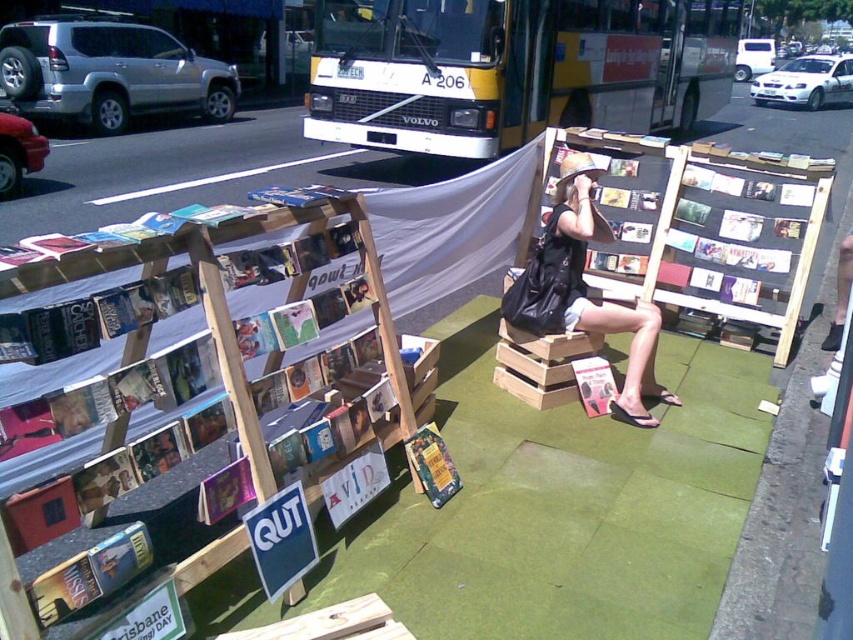
You are a delivery person who needs to load a large package into a truck. You see the yellow metallic bus at upper center and the hardcover book at center. Which item can you move to make space for the truck?

The yellow metallic bus at upper center is bigger than the hardcover book at center, so you should move the yellow metallic bus at upper center to make space for the truck.

You are a pedestrian standing at the street corner where the book sale is happening. You see the yellow metallic bus at upper center and the matte black bag at center. Which object is positioned higher in the image?

The yellow metallic bus at upper center is located above the matte black bag at center, so it is positioned higher in the image.